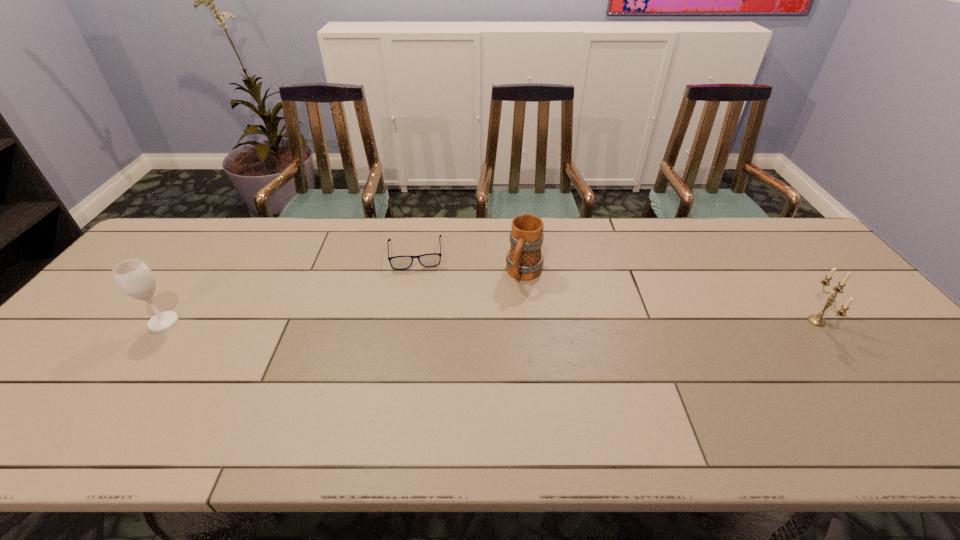
The image size is (960, 540). I want to click on vacant space on the desktop that is between the wineglass and the rightmost object and is positioned on the side of the third object from left to right with the handle, so click(500, 322).

Find the location of a particular element. free space on the desktop that is between the wineglass and the rightmost object and is positioned on the front-facing side of the shortest object is located at coordinates (420, 322).